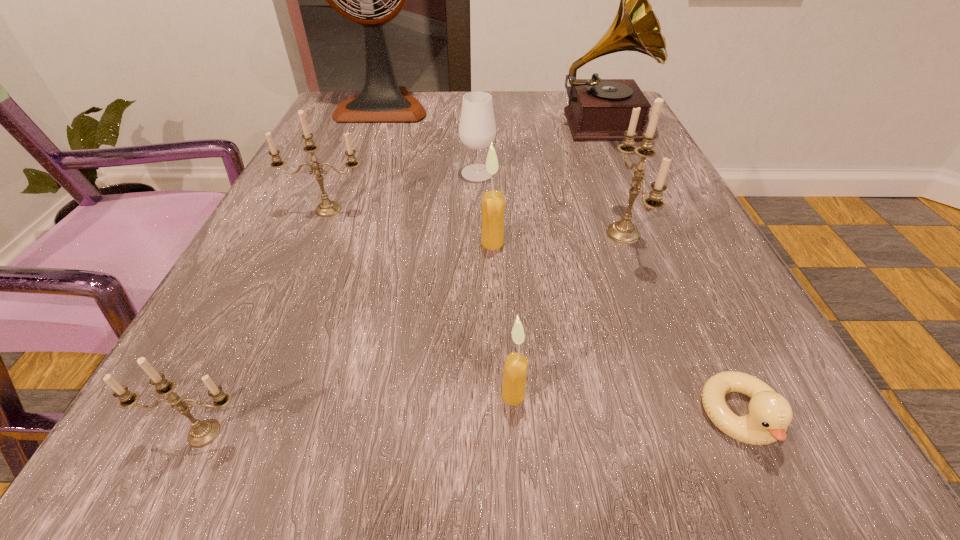
You are a GUI agent. You are given a task and a screenshot of the screen. Output one action in this format:
    pyautogui.click(x=<x>, y=<y>)
    Task: Click on the free spot located on the right of the second nearest candle
    The image size is (960, 540).
    Given the screenshot: What is the action you would take?
    pyautogui.click(x=688, y=395)

The width and height of the screenshot is (960, 540). Find the location of `vacant space located on the right of the smallest metallic candle`. vacant space located on the right of the smallest metallic candle is located at coordinates (559, 434).

Find the location of `fan that is at the far edge`. fan that is at the far edge is located at coordinates (381, 100).

Locate an element on the screen. The height and width of the screenshot is (540, 960). phonograph record that is at the far edge is located at coordinates (599, 109).

Identify the location of candle positioned at the near edge. (202, 433).

I want to click on duckling situated at the near edge, so 770,414.

Locate an element on the screen. The width and height of the screenshot is (960, 540). fan at the left edge is located at coordinates (381, 100).

You are a GUI agent. You are given a task and a screenshot of the screen. Output one action in this format:
    pyautogui.click(x=<x>, y=<y>)
    Task: Click on the phonograph record present at the right edge
    The height and width of the screenshot is (540, 960).
    Given the screenshot: What is the action you would take?
    pyautogui.click(x=599, y=109)

Where is `candle located in the right edge section of the desktop`? The height and width of the screenshot is (540, 960). candle located in the right edge section of the desktop is located at coordinates (623, 231).

Where is `duckling positioned at the right edge`? Image resolution: width=960 pixels, height=540 pixels. duckling positioned at the right edge is located at coordinates (770, 414).